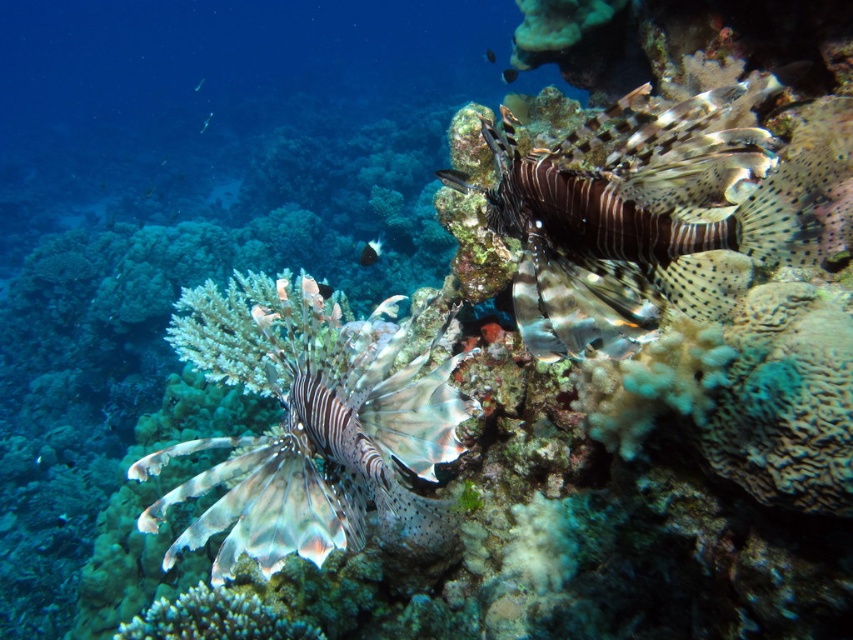
Question: Is shiny silver fish at upper right smaller than translucent white fish at upper center?

Choices:
 (A) yes
 (B) no

Answer: (B)

Question: Which of these objects is positioned farthest from the shiny silver fish at center?

Choices:
 (A) translucent white fish at upper center
 (B) shiny silver fish at upper right
 (C) speckled brown and white fish at upper right

Answer: (A)

Question: Is translucent blue fish at upper center to the left of translucent blue fish at upper left from the viewer's perspective?

Choices:
 (A) yes
 (B) no

Answer: (B)

Question: Where is shiny silver fish at center located in relation to translucent white fish at center in the image?

Choices:
 (A) below
 (B) above

Answer: (B)

Question: Among these points, which one is farthest from the camera?

Choices:
 (A) (202, 84)
 (B) (509, 67)

Answer: (A)

Question: Which point is farther to the camera?

Choices:
 (A) (344, 528)
 (B) (380, 241)
 (C) (399, 300)

Answer: (B)